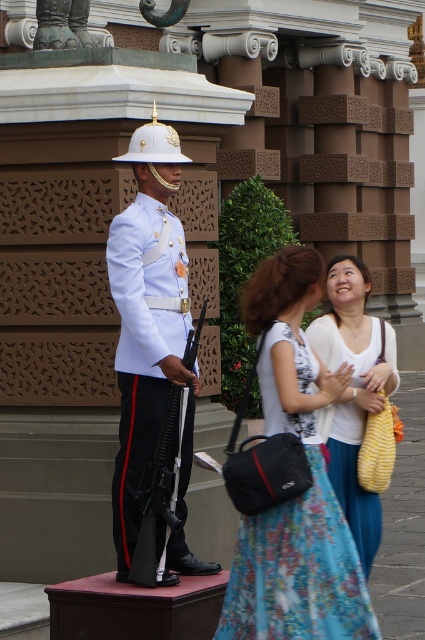
Question: Which of the following is the farthest from the observer?

Choices:
 (A) (277, 323)
 (B) (235, 625)

Answer: (A)

Question: Can you confirm if floral dress at center is thinner than floral cotton dress at lower center?

Choices:
 (A) yes
 (B) no

Answer: (A)

Question: Which point is closer to the camera?

Choices:
 (A) white glossy uniform at center
 (B) floral cotton dress at lower center
 (C) white fabric dress at center

Answer: (B)

Question: Is white glossy uniform at center bigger than white fabric dress at center?

Choices:
 (A) yes
 (B) no

Answer: (B)

Question: Which point is closer to the camera?

Choices:
 (A) floral cotton dress at lower center
 (B) white glossy uniform at center

Answer: (A)

Question: Where is floral cotton dress at lower center located in relation to white glossy uniform at center in the image?

Choices:
 (A) below
 (B) above

Answer: (A)